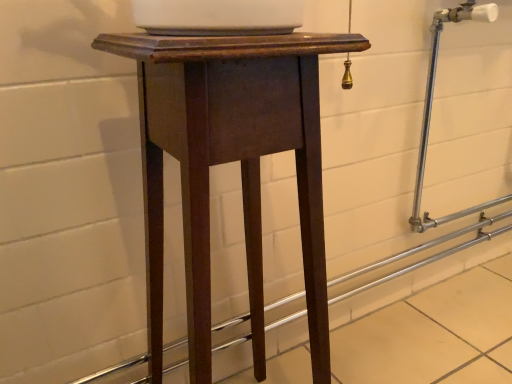
I want to click on dark wood pedestal at center, so click(228, 162).

The image size is (512, 384). What do you see at coordinates (228, 162) in the screenshot?
I see `dark wood pedestal at center` at bounding box center [228, 162].

You are a GUI agent. You are given a task and a screenshot of the screen. Output one action in this format:
    pyautogui.click(x=<x>, y=<y>)
    Task: Click on the dark wood pedestal at center
    
    Given the screenshot: What is the action you would take?
    pyautogui.click(x=228, y=162)